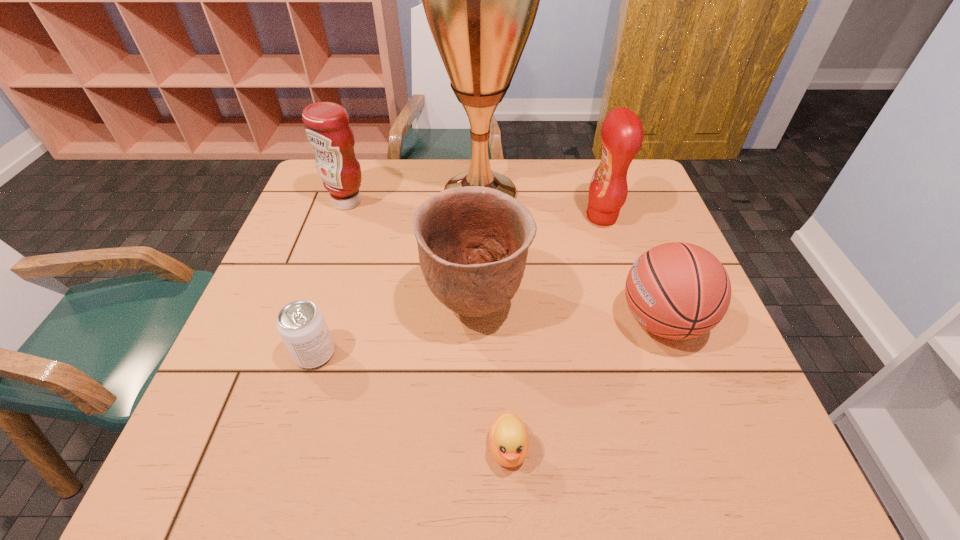
Find the location of a particular element. This screenshot has width=960, height=540. the fifth closest object relative to the right condiment is located at coordinates (327, 127).

The image size is (960, 540). Find the location of `object that stands as the sixth closest to the pottery`. object that stands as the sixth closest to the pottery is located at coordinates (327, 127).

This screenshot has width=960, height=540. I want to click on vacant space that satisfies the following two spatial constraints: 1. on the back side of the pottery; 2. on the right side of the tallest object, so click(477, 193).

The width and height of the screenshot is (960, 540). I want to click on vacant space that satisfies the following two spatial constraints: 1. on the back side of the soda can; 2. on the left side of the pottery, so click(x=330, y=306).

The image size is (960, 540). I want to click on free location that satisfies the following two spatial constraints: 1. on the back side of the pottery; 2. on the left side of the sixth tallest object, so click(x=330, y=306).

At what (x,y) coordinates should I click in order to perform the action: click on free space that satisfies the following two spatial constraints: 1. on the back side of the pottery; 2. on the left side of the soda can. Please return your answer as a coordinate pair (x, y). This screenshot has height=540, width=960. Looking at the image, I should click on (330, 306).